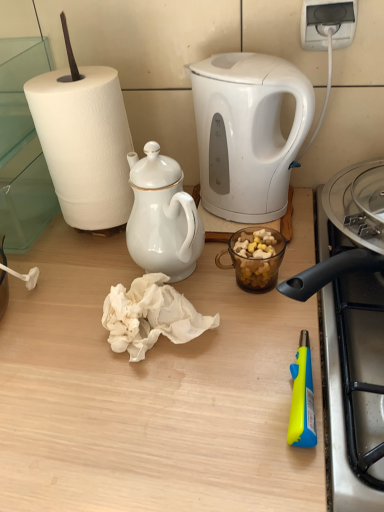
Identify the location of free space in front of white crumpled paper towel at center. This screenshot has width=384, height=512. (151, 430).